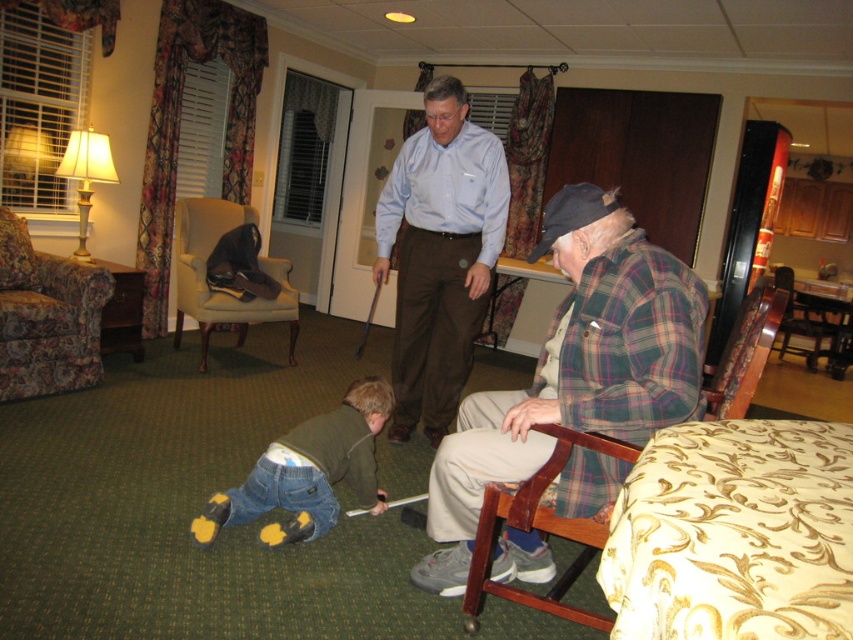
You are a parent trying to find your child who is wearing denim jeans at lower left. You see the floral fabric armchair at left in the room. Which object is bigger?

The floral fabric armchair at left is bigger than the denim jeans at lower left.